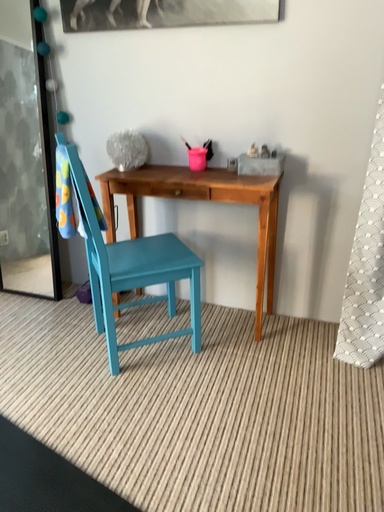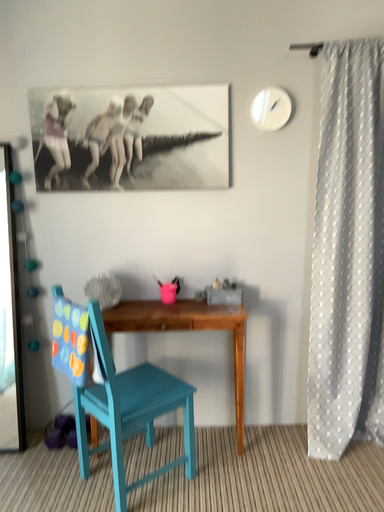
Question: How did the camera likely rotate when shooting the video?

Choices:
 (A) rotated upward
 (B) rotated downward

Answer: (A)